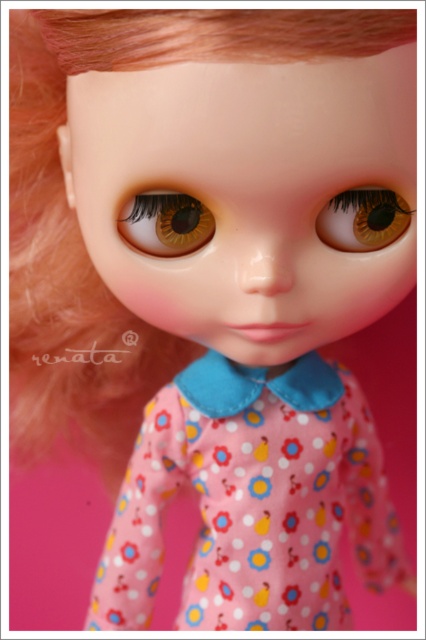
You are a fashion designer examining the doll and want to adjust its outfit. Since the pink fabric dress at center and the brown matte eye at center are both central elements, which one is located to the right when viewed from the front?

The pink fabric dress at center is positioned on the right side of the brown matte eye at center, so when viewed from the front, the pink fabric dress at center is to the right of the brown matte eye at center.

You are an artist trying to paint the doll in the image. You need to locate the exact position of point (253, 500) on the doll. According to the image, where is this point located?

The point (253, 500) is located on the pink fabric dress at center.

You are looking at the doll and notice two points marked on its dress. The first point is at coordinates point [213,620] and the second is at point [365,195]. From your perspective, which point is closer to you?

Point [365,195] is closer to you because point [213,620] is behind it according to the coordinates provided.